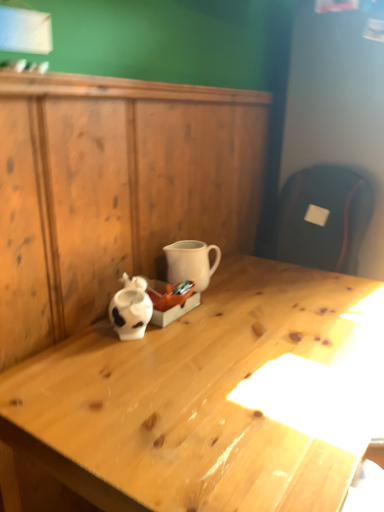
Locate an element on the screen. The height and width of the screenshot is (512, 384). wooden dresser at center is located at coordinates (114, 190).

The width and height of the screenshot is (384, 512). What do you see at coordinates (191, 262) in the screenshot?
I see `white matte coffee cup at center` at bounding box center [191, 262].

What do you see at coordinates (186, 401) in the screenshot? I see `light wood desk at center` at bounding box center [186, 401].

Identify the location of wooden dresser at center. (114, 190).

Who is shorter, white matte coffee cup at center or wooden dresser at center?

white matte coffee cup at center.

Which point is more distant from viewer, (204, 269) or (73, 220)?

The point (204, 269) is behind.

How many degrees apart are the facing directions of white matte coffee cup at center and wooden dresser at center?

0.424 degrees separate the facing orientations of white matte coffee cup at center and wooden dresser at center.

Is white matte coffee cup at center looking in the opposite direction of wooden dresser at center?

Yes, white matte coffee cup at center is positioned with its back facing wooden dresser at center.

Which of these two, wooden dresser at center or white matte coffee cup at center, is wider?

white matte coffee cup at center.

From the picture: Between wooden dresser at center and white matte coffee cup at center, which one has more height?

wooden dresser at center is taller.

What's the angular difference between wooden dresser at center and white matte coffee cup at center's facing directions?

0.424 degrees.

Consider the image. Is light wood desk at center thinner than white matte coffee cup at center?

No.

Is light wood desk at center oriented towards white matte coffee cup at center?

No, light wood desk at center is not facing towards white matte coffee cup at center.

Which is in front, point (38, 370) or point (190, 241)?

The point (38, 370) is closer to the camera.

Is light wood desk at center bigger or smaller than white matte coffee cup at center?

In the image, light wood desk at center appears to be larger than white matte coffee cup at center.

From a real-world perspective, which is physically above, light wood desk at center or wooden dresser at center?

In real-world perspective, wooden dresser at center is above.

In order to click on dresser located above the light wood desk at center (from the image's perspective) in this screenshot , I will do `click(114, 190)`.

Consider the image. Is light wood desk at center wider than wooden dresser at center?

Correct, the width of light wood desk at center exceeds that of wooden dresser at center.

From the image's perspective, does light wood desk at center appear higher than wooden dresser at center?

No.

Which is more to the right, white matte coffee cup at center or light wood desk at center?

From the viewer's perspective, light wood desk at center appears more on the right side.

Is white matte coffee cup at center located outside light wood desk at center?

Absolutely, white matte coffee cup at center is external to light wood desk at center.

Does white matte coffee cup at center touch light wood desk at center?

No, white matte coffee cup at center is not beside light wood desk at center.

How distant is white matte coffee cup at center from light wood desk at center?

white matte coffee cup at center and light wood desk at center are 13.89 inches apart.

At what (x,y) coordinates should I click in order to perform the action: click on desk in front of the wooden dresser at center. Please return your answer as a coordinate pair (x, y). The image size is (384, 512). Looking at the image, I should click on (186, 401).

How different are the orientations of wooden dresser at center and light wood desk at center in degrees?

They differ by 0.786 degrees in their facing directions.

Does wooden dresser at center have a smaller size compared to light wood desk at center?

Yes.

Does point (95, 84) come in front of point (87, 454)?

That is False.

At what (x,y) coordinates should I click in order to perform the action: click on dresser lying on the right of white matte coffee cup at center. Please return your answer as a coordinate pair (x, y). Looking at the image, I should click on (114, 190).

Where is `coffee cup that appears behind the wooden dresser at center`? This screenshot has width=384, height=512. coffee cup that appears behind the wooden dresser at center is located at coordinates (191, 262).

From the image, which object appears to be nearer to light wood desk at center, wooden dresser at center or white matte coffee cup at center?

white matte coffee cup at center lies closer to light wood desk at center than the other object.

When comparing their distances from white matte coffee cup at center, does wooden dresser at center or light wood desk at center seem closer?

wooden dresser at center.

Based on their spatial positions, is light wood desk at center or wooden dresser at center further from white matte coffee cup at center?

Among the two, light wood desk at center is located further to white matte coffee cup at center.

From the image, which object appears to be nearer to light wood desk at center, white matte coffee cup at center or wooden dresser at center?

white matte coffee cup at center.

When comparing their distances from wooden dresser at center, does white matte coffee cup at center or light wood desk at center seem closer?

The object closer to wooden dresser at center is white matte coffee cup at center.

Based on their spatial positions, is light wood desk at center or white matte coffee cup at center further from wooden dresser at center?

The object further to wooden dresser at center is light wood desk at center.

Where is `dresser located between light wood desk at center and white matte coffee cup at center in the depth direction`? The height and width of the screenshot is (512, 384). dresser located between light wood desk at center and white matte coffee cup at center in the depth direction is located at coordinates (114, 190).